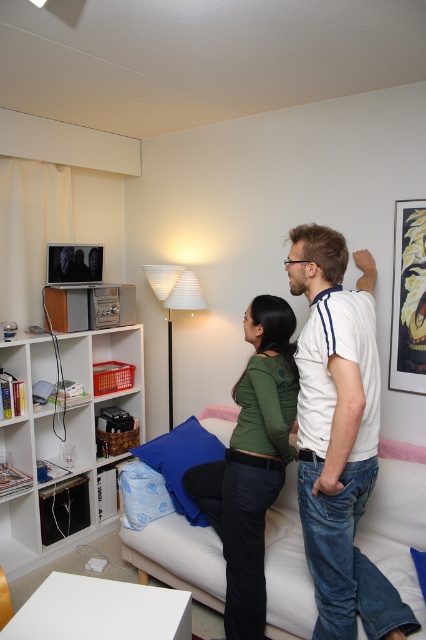
Which is above, white cotton t-shirt at upper center or blue fabric pillow at center?

Positioned higher is white cotton t-shirt at upper center.

Consider the image. Does white cotton t-shirt at upper center have a lesser height compared to blue fabric pillow at center?

No.

Which is behind, point (348, 384) or point (169, 484)?

Positioned behind is point (169, 484).

Locate an element on the screen. This screenshot has height=640, width=426. white cotton t-shirt at upper center is located at coordinates (339, 436).

Does white cotton t-shirt at upper center have a greater height compared to white plastic bookshelf at left?

Yes.

Is point (301, 280) positioned after point (40, 541)?

No, (301, 280) is in front of (40, 541).

I want to click on white cotton t-shirt at upper center, so click(339, 436).

Consider the image. Can you confirm if green matte shirt at center is taller than blue fabric pillow at center?

Yes.

Is green matte shirt at center further to camera compared to blue fabric pillow at center?

No.

Does point (230, 616) come farther from viewer compared to point (173, 488)?

That is False.

Identify the location of green matte shirt at center. The height and width of the screenshot is (640, 426). (252, 461).